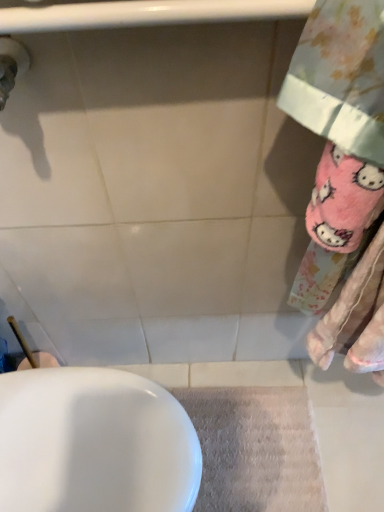
Question: Based on their positions, is white glossy sink at lower left located to the left or right of beige textured bath mat at lower center?

Choices:
 (A) left
 (B) right

Answer: (A)

Question: Is point (84, 431) positioned closer to the camera than point (218, 424)?

Choices:
 (A) farther
 (B) closer

Answer: (B)

Question: Considering their positions, is white glossy sink at lower left located in front of or behind beige textured bath mat at lower center?

Choices:
 (A) front
 (B) behind

Answer: (A)

Question: In terms of size, does beige textured bath mat at lower center appear bigger or smaller than white glossy sink at lower left?

Choices:
 (A) small
 (B) big

Answer: (A)

Question: From a real-world perspective, is beige textured bath mat at lower center physically located above or below white glossy sink at lower left?

Choices:
 (A) below
 (B) above

Answer: (A)

Question: From the image's perspective, is beige textured bath mat at lower center above or below white glossy sink at lower left?

Choices:
 (A) below
 (B) above

Answer: (A)

Question: Considering the positions of beige textured bath mat at lower center and white glossy sink at lower left in the image, is beige textured bath mat at lower center taller or shorter than white glossy sink at lower left?

Choices:
 (A) tall
 (B) short

Answer: (B)